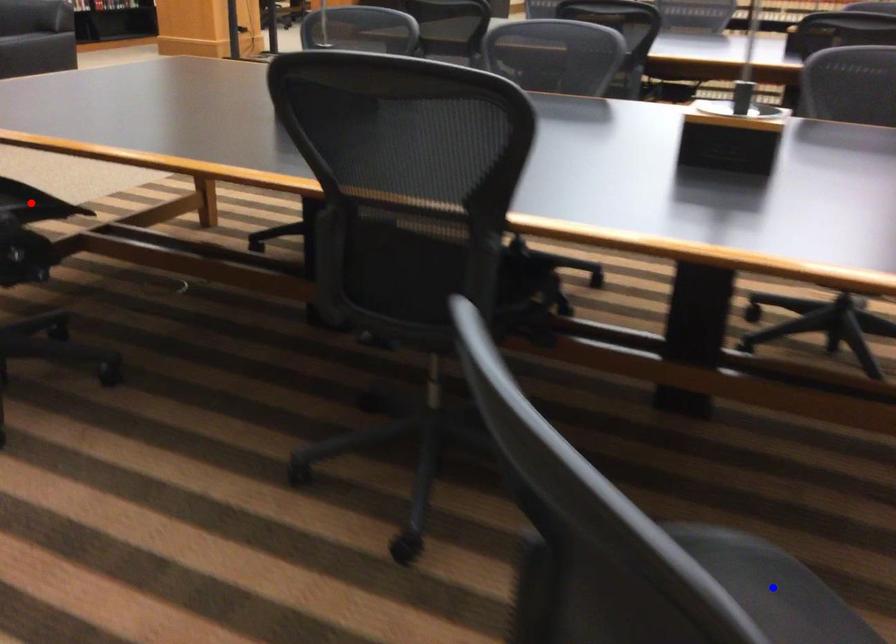
Question: In the image, two points are highlighted. Which point is nearer to the camera? Reply with the corresponding letter.

Choices:
 (A) blue point
 (B) red point

Answer: (A)